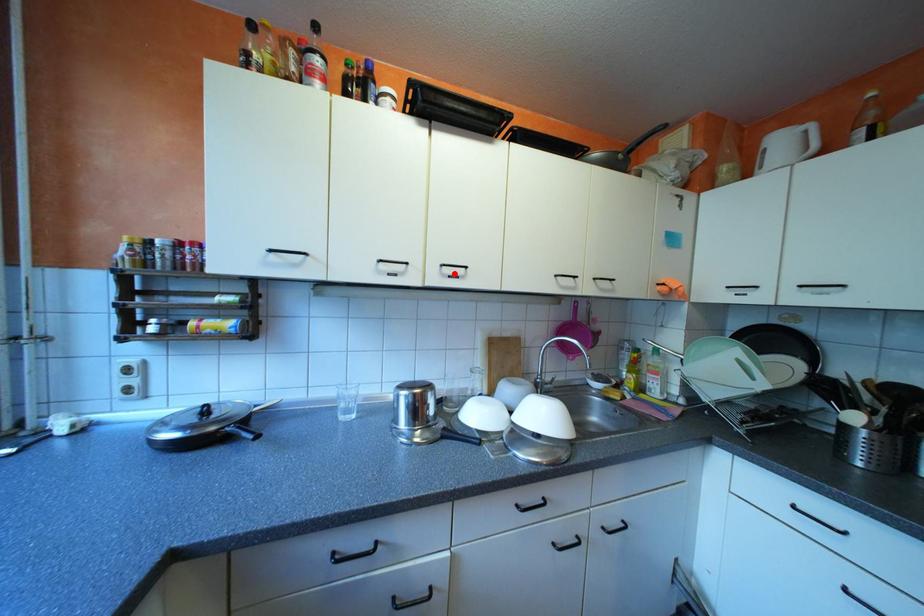
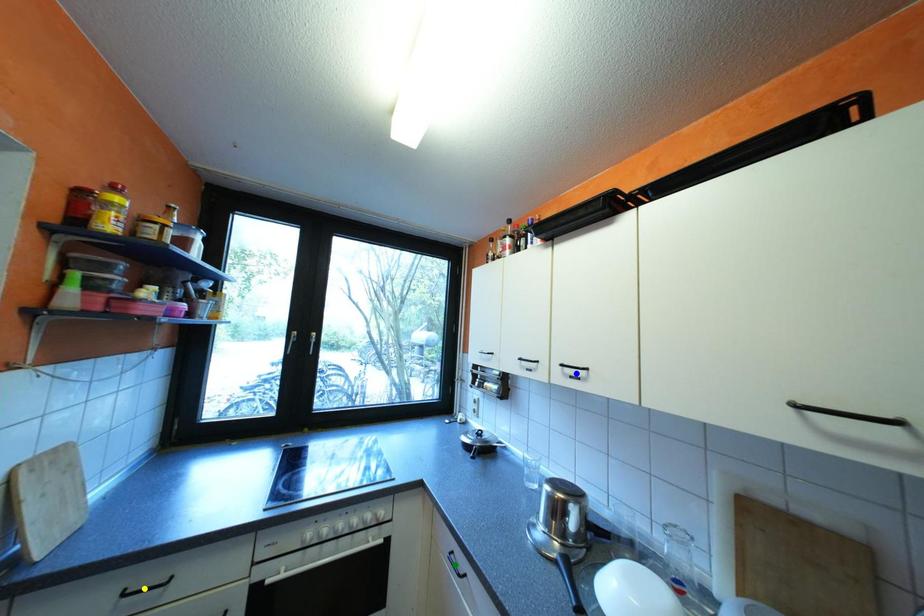
Question: I am providing you with two images of the same scene from different viewpoints. A red point is marked on the first image. You are given multiple points on the second image. Can you choose the point in image 2 that corresponds to the point in image 1?

Choices:
 (A) blue point
 (B) yellow point
 (C) green point

Answer: (A)